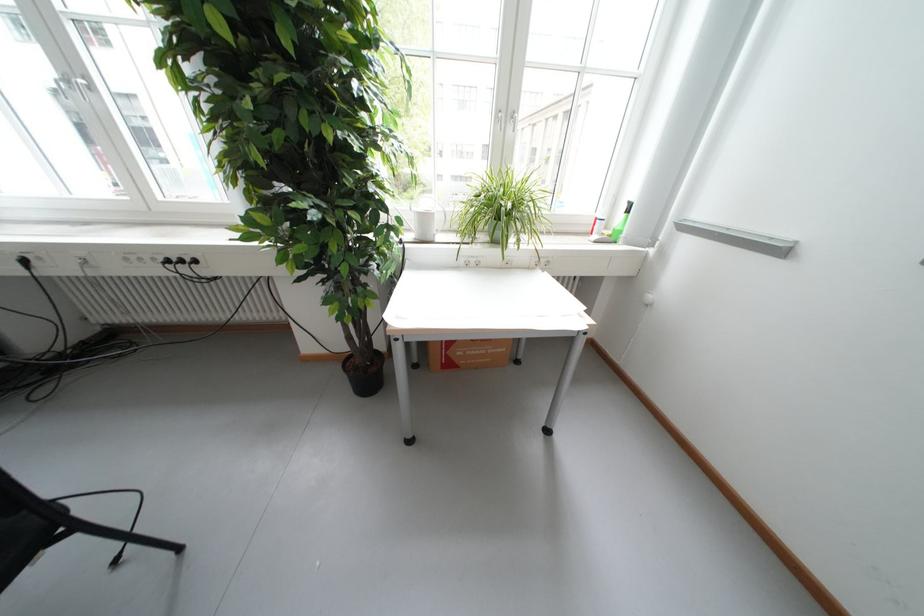
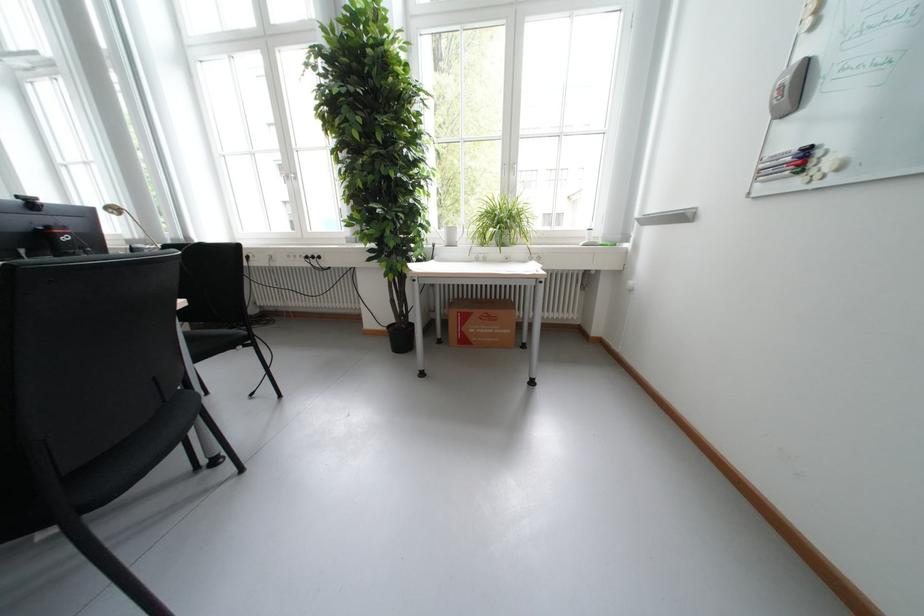
The point at (x=435, y=220) is marked in the first image. Where is the corresponding point in the second image?

(460, 233)